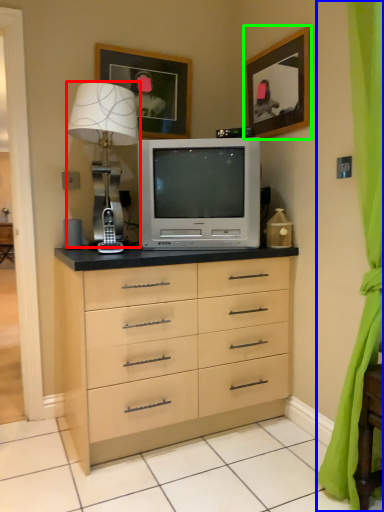
Question: Which object is positioned closest to table lamp (highlighted by a red box)? Select from curtain (highlighted by a blue box) and picture frame (highlighted by a green box).

Choices:
 (A) curtain
 (B) picture frame

Answer: (B)